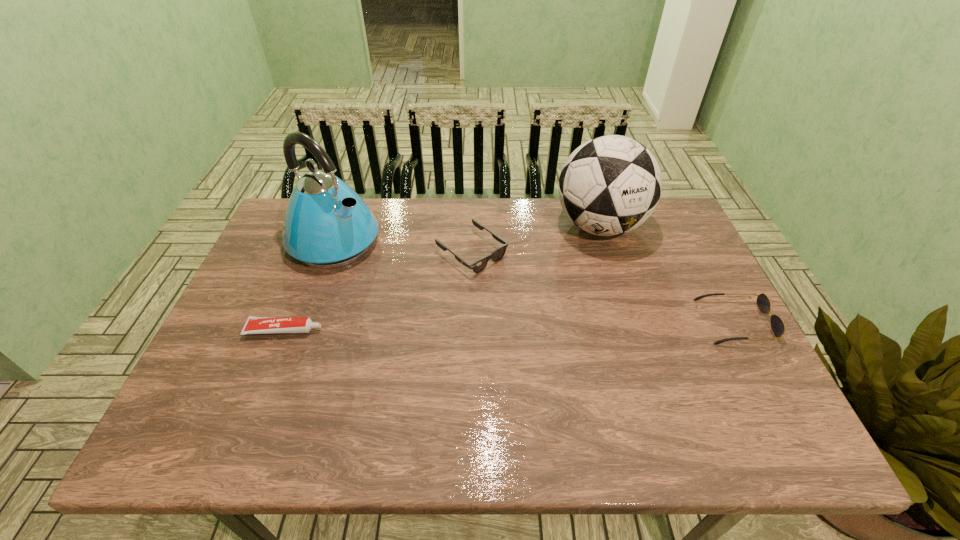
You are a GUI agent. You are given a task and a screenshot of the screen. Output one action in this format:
    pyautogui.click(x=<x>, y=<y>)
    Task: Click on the vacant point at the near left corner
    The width and height of the screenshot is (960, 540).
    Given the screenshot: What is the action you would take?
    pyautogui.click(x=252, y=394)

I want to click on free location at the far right corner of the desktop, so click(x=646, y=226).

This screenshot has height=540, width=960. In order to click on empty location between the shortest object and the farther sunglasses in this screenshot , I will do [378, 292].

Find the location of `empty space between the soccer ball and the nearer sunglasses`. empty space between the soccer ball and the nearer sunglasses is located at coordinates (667, 274).

What are the coordinates of `free space between the rightmost object and the second tallest object` in the screenshot? It's located at (667, 274).

I want to click on free area in between the farther sunglasses and the soccer ball, so click(536, 239).

The height and width of the screenshot is (540, 960). I want to click on blank region between the shortest object and the nearer sunglasses, so click(510, 326).

Identify the location of vacant space that is in between the toothpaste and the third object from left to right. (378, 292).

Identify the location of empty location between the left sunglasses and the tallest object. This screenshot has width=960, height=540. (403, 247).

Where is `free space that is in between the farther sunglasses and the right sunglasses`? free space that is in between the farther sunglasses and the right sunglasses is located at coordinates (603, 287).